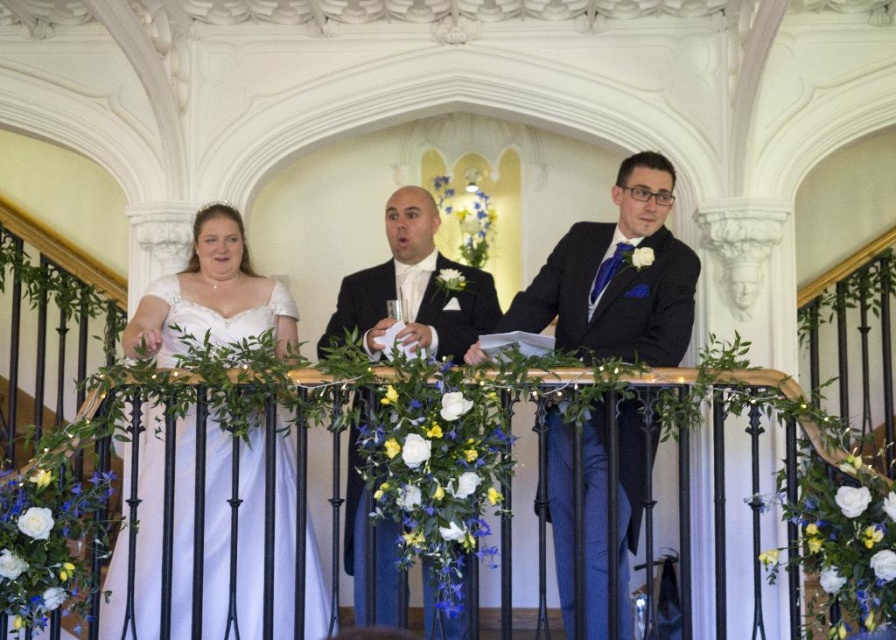
Is white satin dress at center to the left of white satin dress at left from the viewer's perspective?

In fact, white satin dress at center is to the right of white satin dress at left.

Does white satin dress at center appear under white satin dress at left?

Actually, white satin dress at center is above white satin dress at left.

The height and width of the screenshot is (640, 896). What do you see at coordinates (616, 276) in the screenshot?
I see `white satin dress at center` at bounding box center [616, 276].

Image resolution: width=896 pixels, height=640 pixels. I want to click on white satin dress at center, so click(616, 276).

Can you confirm if white satin dress at center is positioned above shiny black suit at center?

Yes.

Consider the image. Is white satin dress at center to the right of shiny black suit at center from the viewer's perspective?

Correct, you'll find white satin dress at center to the right of shiny black suit at center.

Where is `white satin dress at center`? white satin dress at center is located at coordinates (616, 276).

This screenshot has height=640, width=896. What do you see at coordinates (210, 296) in the screenshot?
I see `white satin dress at left` at bounding box center [210, 296].

Who is taller, white satin dress at left or matte black suit at center?

With more height is matte black suit at center.

This screenshot has width=896, height=640. Describe the element at coordinates (210, 296) in the screenshot. I see `white satin dress at left` at that location.

You are a GUI agent. You are given a task and a screenshot of the screen. Output one action in this format:
    pyautogui.click(x=<x>, y=<y>)
    Task: Click on the white satin dress at left
    The height and width of the screenshot is (640, 896).
    Given the screenshot: What is the action you would take?
    pyautogui.click(x=210, y=296)